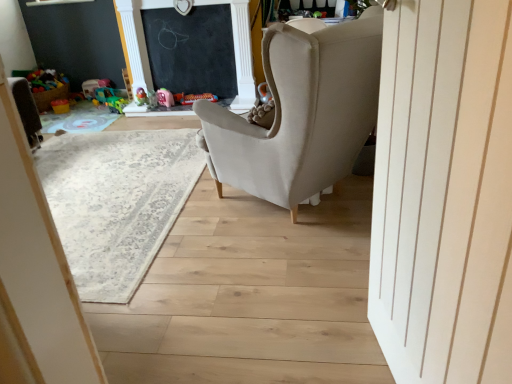
You are a GUI agent. You are given a task and a screenshot of the screen. Output one action in this format:
    pyautogui.click(x=<x>, y=<y>)
    Task: Click on the free point in front of rubberized green toy at center, the second toy in the left-to-right sequence
    
    Given the screenshot: What is the action you would take?
    pyautogui.click(x=111, y=114)